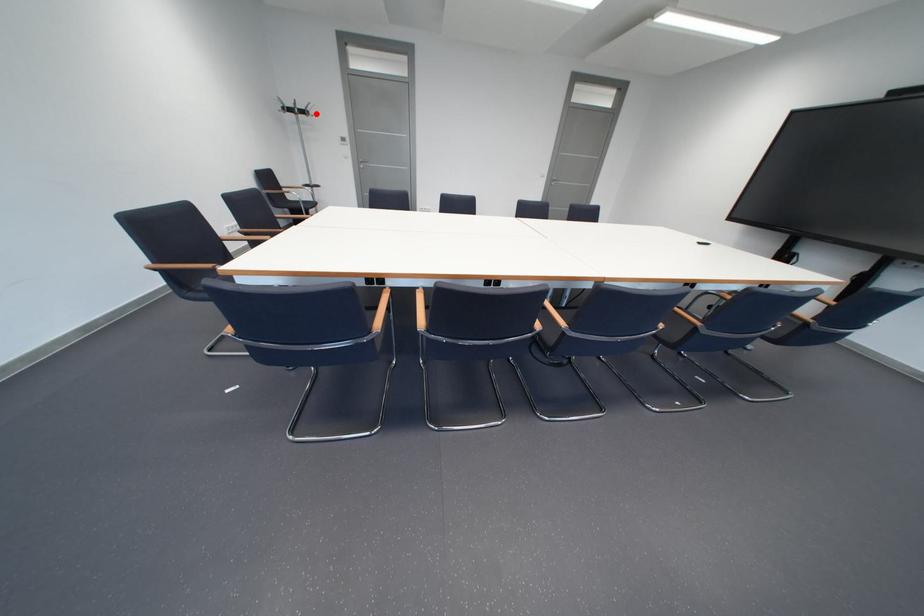
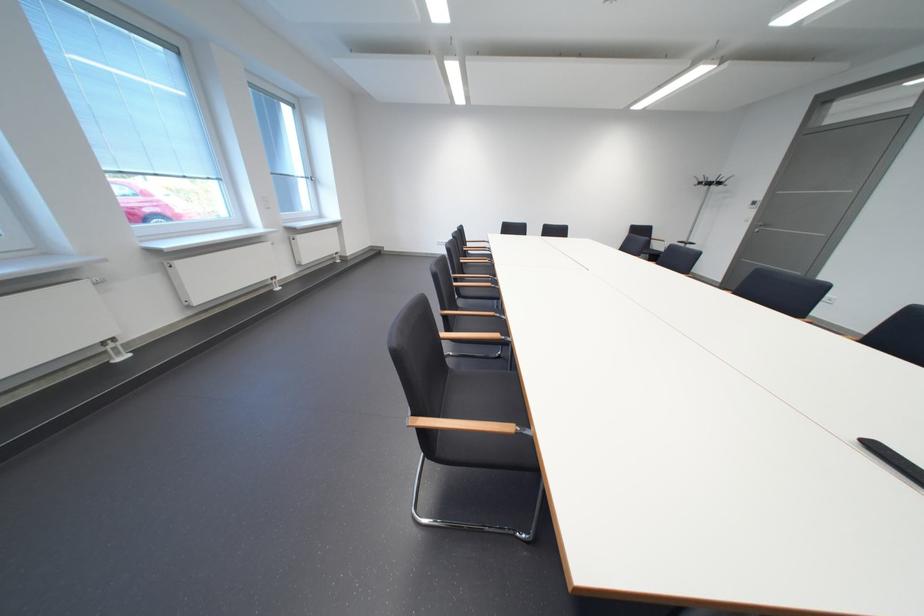
In the second image, find the point that corresponds to the highlighted location in the first image.

(723, 185)